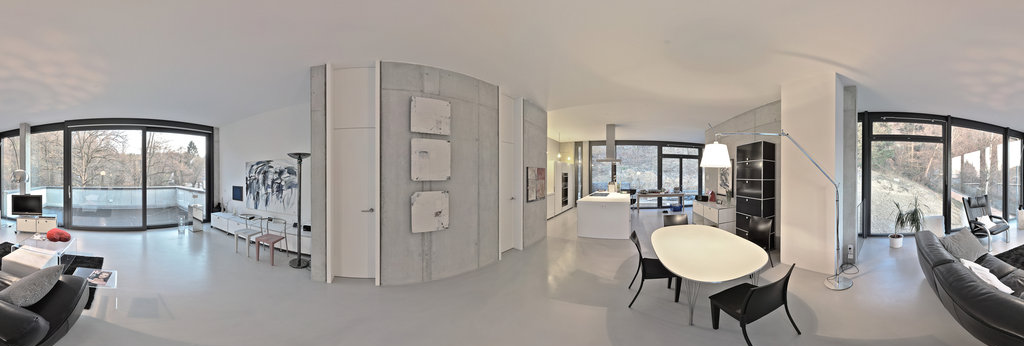
Identify the location of chair. The image size is (1024, 346). (762, 297).